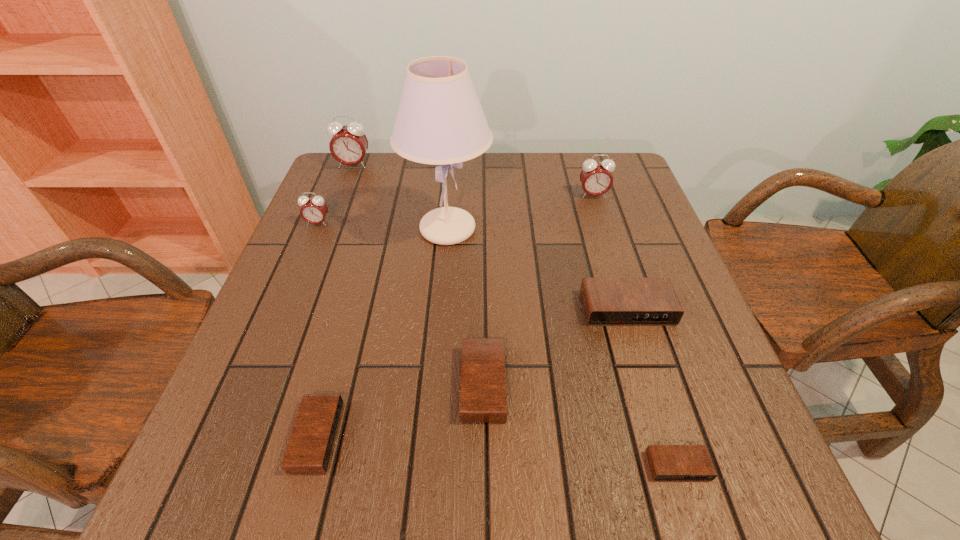
Identify which black alarm clock is the fourth nearest to the tallest object. Please provide its 2D coordinates. Your answer should be formatted as a tuple, i.e. [(x, y)], where the tuple contains the x and y coordinates of a point satisfying the conditions above.

[(667, 462)]

Identify the location of vacant space that satisfies the following two spatial constraints: 1. on the clock face of the fourth tallest object; 2. on the right side of the tallest object. (316, 229).